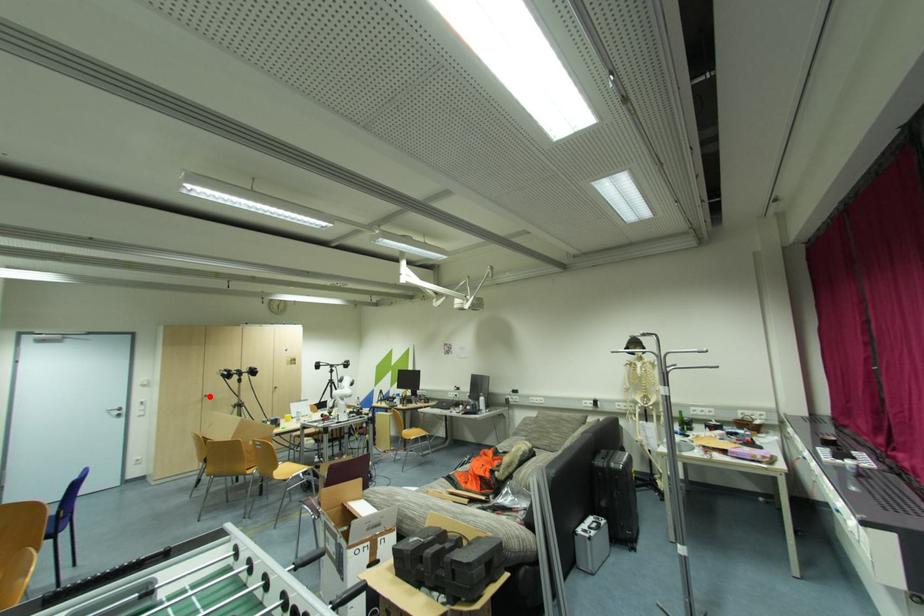
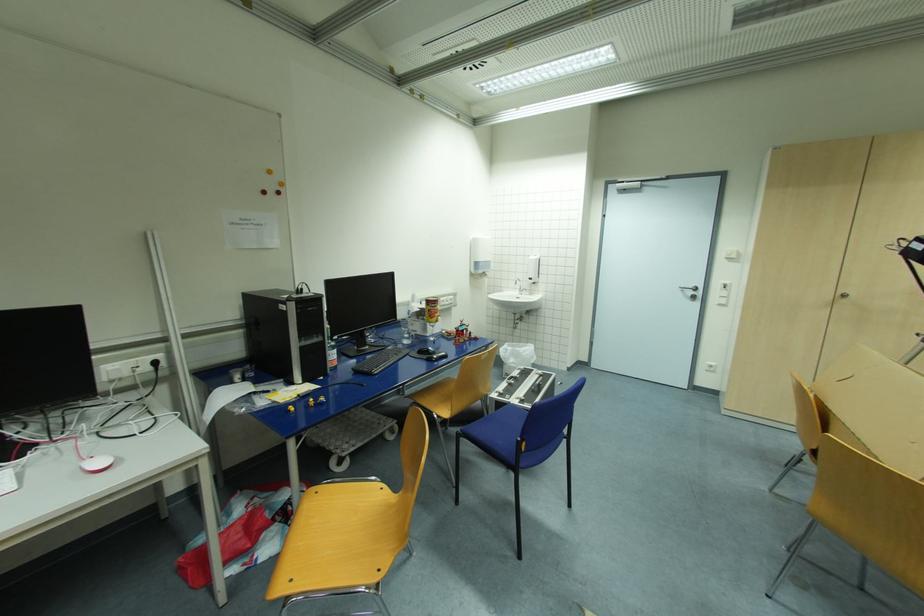
The point at the highlighted location is marked in the first image. Where is the corresponding point in the second image?

(847, 296)